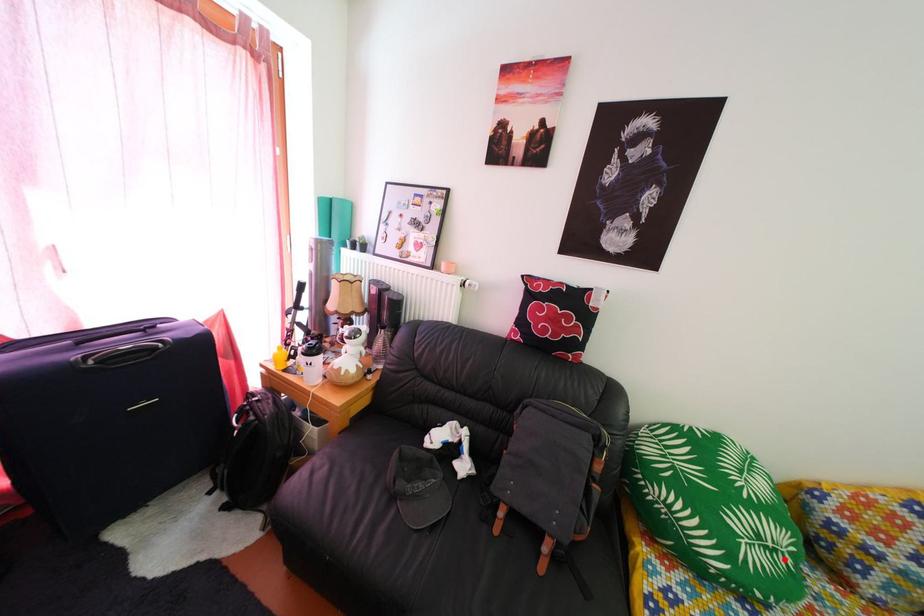
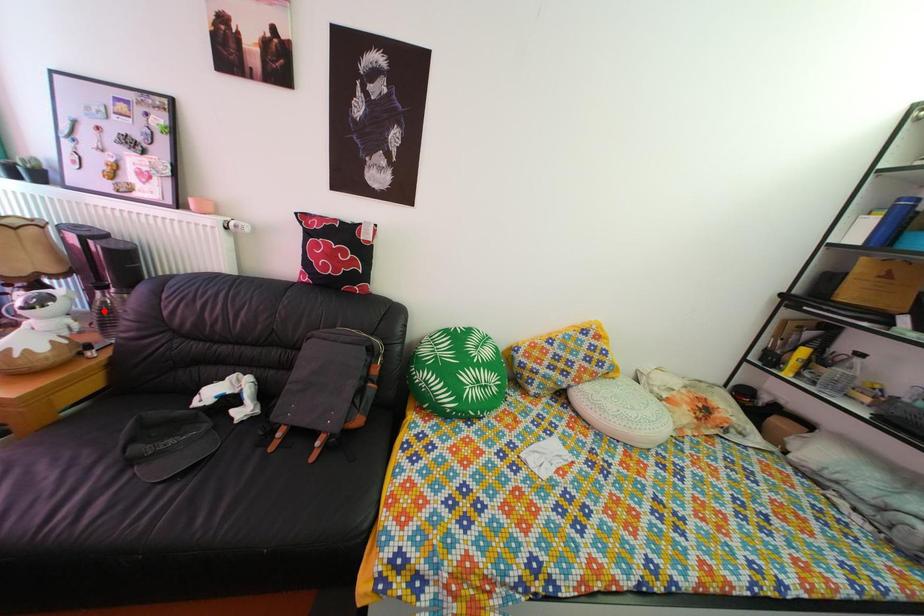
I am providing you with two images of the same scene from different viewpoints. A red point is marked on the first image and another point is marked on the second image. Does the point marked in image1 correspond to the same location as the one in image2?

No